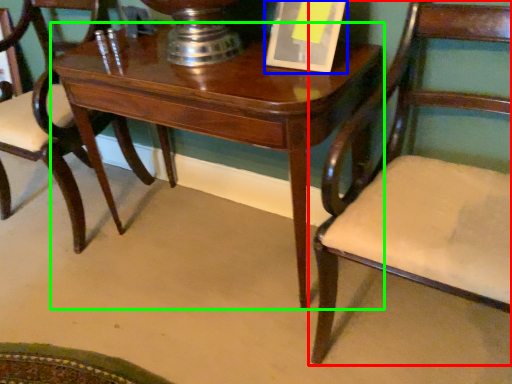
Question: Which object is positioned closest to chair (highlighted by a red box)? Select from paperback book (highlighted by a blue box) and table (highlighted by a green box).

Choices:
 (A) paperback book
 (B) table

Answer: (B)